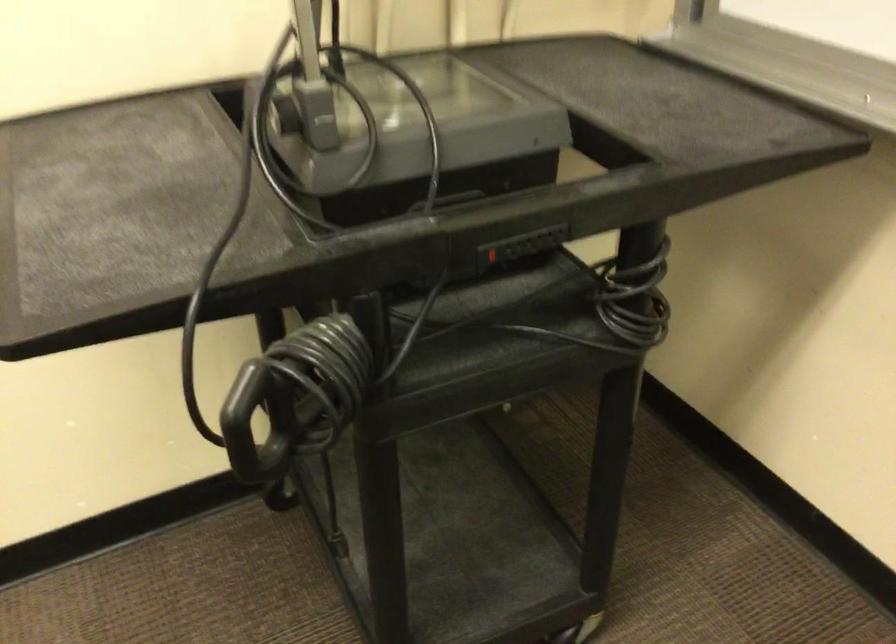
What do you see at coordinates (247, 418) in the screenshot? I see `a black cart handle` at bounding box center [247, 418].